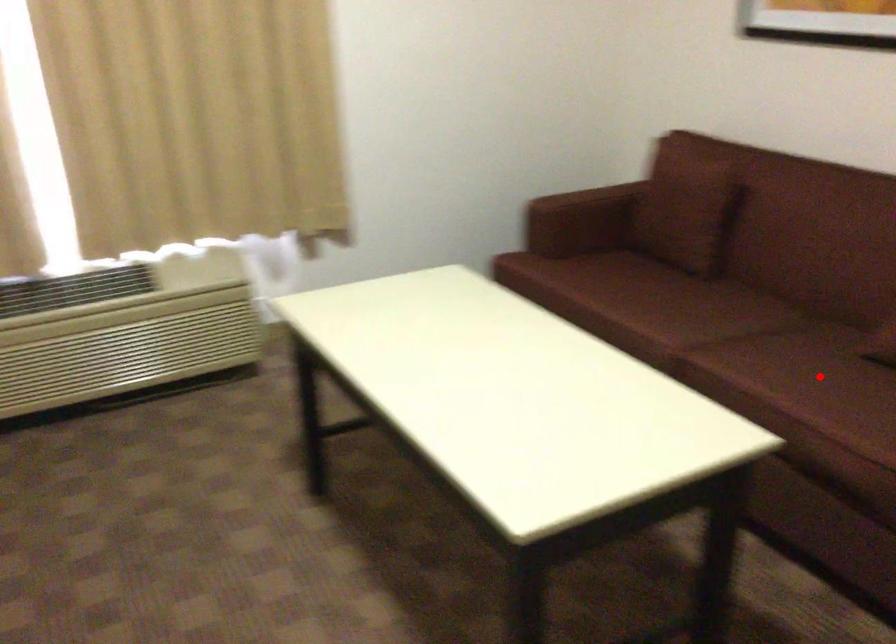
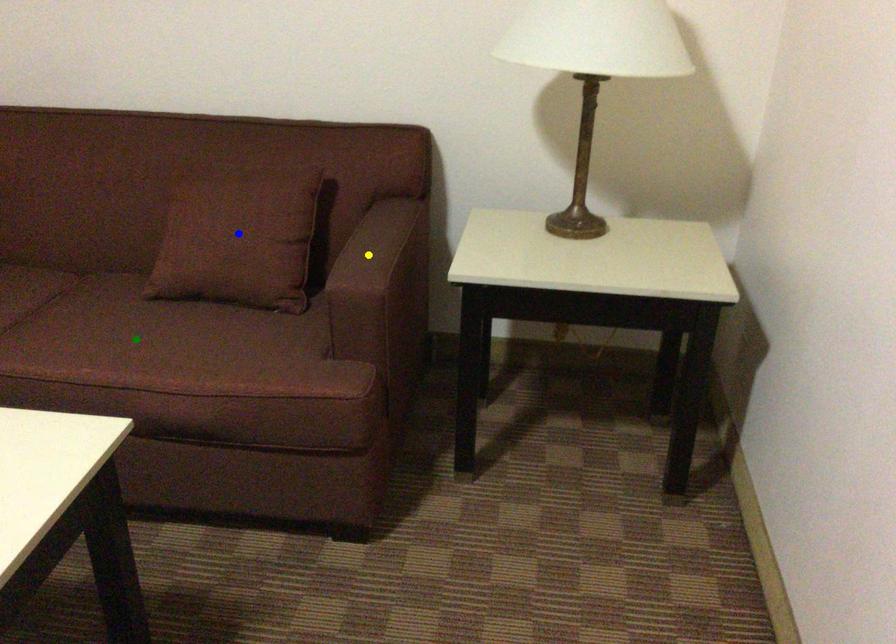
Question: I am providing you with two images of the same scene from different viewpoints. A red point is marked on the first image. You are given multiple points on the second image. Can you choose the point in image 2 that corresponds to the point in image 1?

Choices:
 (A) yellow point
 (B) green point
 (C) blue point

Answer: (B)